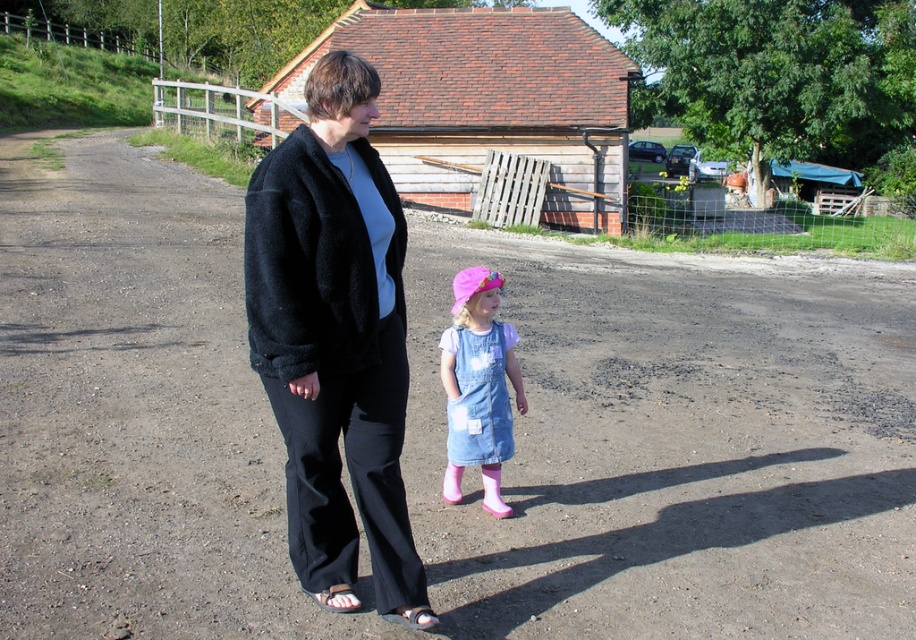
Question: Can you confirm if denim overall at lower right is smaller than black leather sandal at lower center?

Choices:
 (A) no
 (B) yes

Answer: (A)

Question: Is black leather sandal at lower center positioned in front of white fabric sandal at lower left?

Choices:
 (A) yes
 (B) no

Answer: (A)

Question: Which of the following is the closest to the observer?

Choices:
 (A) (467, 371)
 (B) (395, 508)
 (C) (418, 627)

Answer: (C)

Question: Which of these objects is positioned closest to the white fabric sandal at lower left?

Choices:
 (A) denim overall at lower right
 (B) black leather sandal at lower center

Answer: (B)

Question: Which point is farther to the camera?

Choices:
 (A) white fabric sandal at lower left
 (B) black leather sandal at lower center
 (C) black fuzzy jacket at center

Answer: (A)

Question: Does black fuzzy jacket at center have a smaller size compared to denim overall at lower right?

Choices:
 (A) no
 (B) yes

Answer: (A)